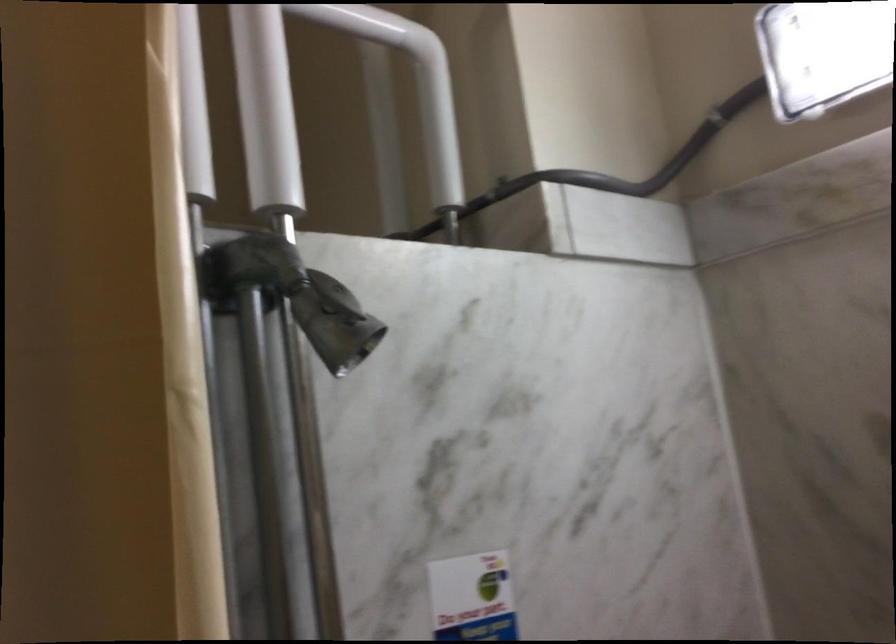
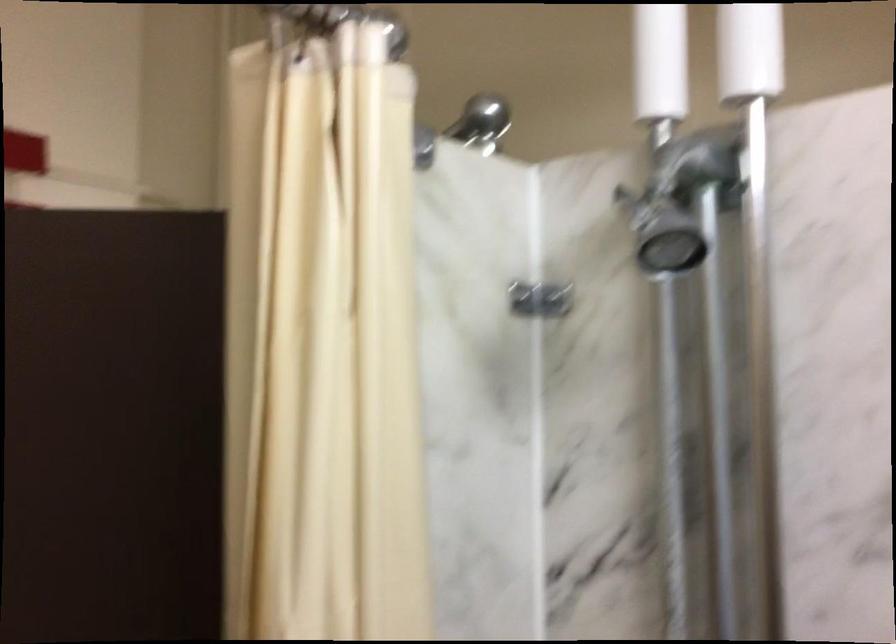
Consider the image. First-person continuous shooting, in which direction is the camera rotating?

The camera rotated toward right-down.